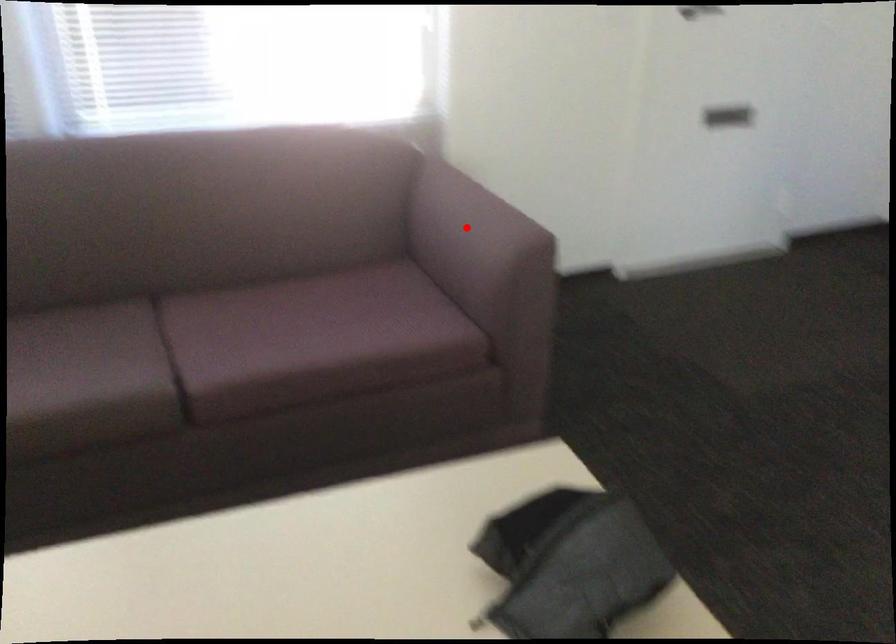
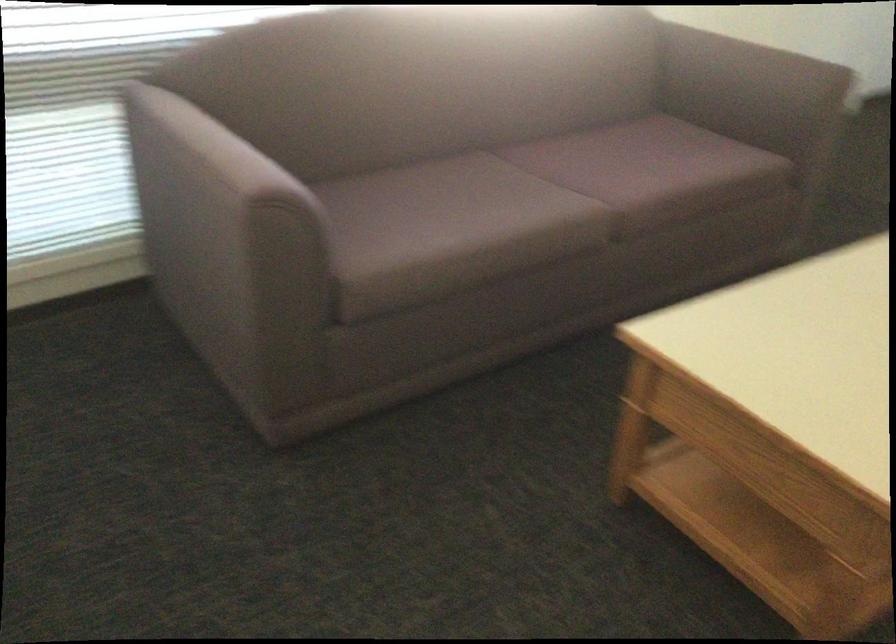
Locate, in the second image, the point that corresponds to the highlighted location in the first image.

(746, 73)